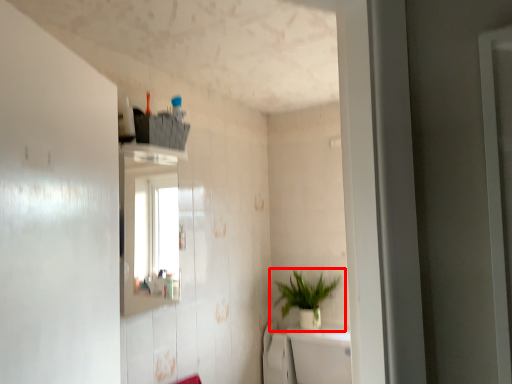
Question: From the image's perspective, where is houseplant (annotated by the red box) located relative to bath?

Choices:
 (A) below
 (B) above

Answer: (B)